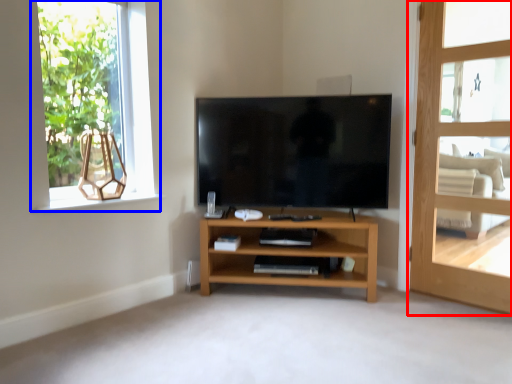
Question: Which object is closer to the camera taking this photo, door (highlighted by a red box) or window (highlighted by a blue box)?

Choices:
 (A) door
 (B) window

Answer: (A)